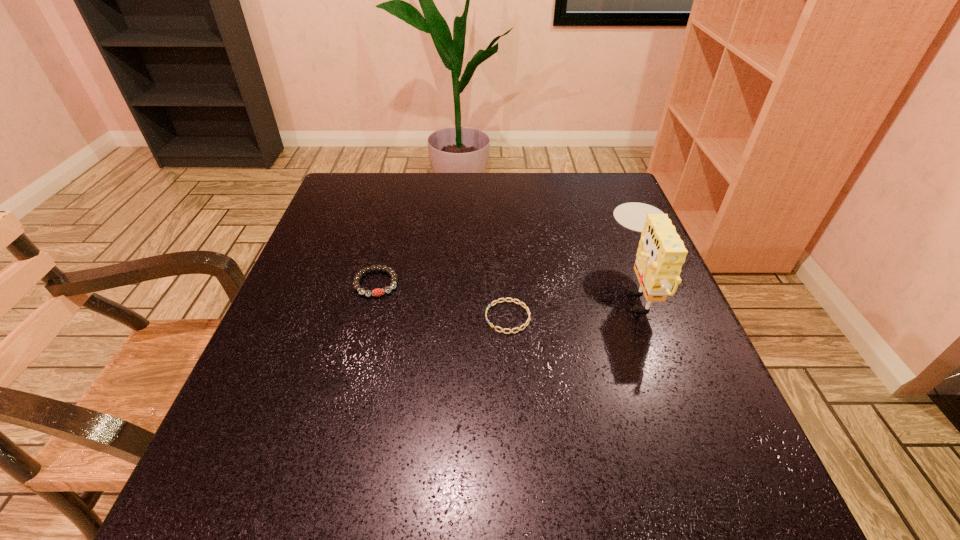
This screenshot has width=960, height=540. I want to click on the tallest object, so click(x=661, y=253).

This screenshot has width=960, height=540. In order to click on sponge in this screenshot , I will do 661,253.

Locate an element on the screen. the farther bracelet is located at coordinates (377, 292).

The width and height of the screenshot is (960, 540). Identify the location of the second tallest object. (377, 292).

Identify the location of the shorter bracelet. (512, 300).

Find the location of `the shortest object`. the shortest object is located at coordinates (512, 300).

Where is `vacant space located 0.280m on the front-facing side of the rightmost object`? vacant space located 0.280m on the front-facing side of the rightmost object is located at coordinates (479, 288).

This screenshot has height=540, width=960. I want to click on vacant area situated on the front-facing side of the rightmost object, so click(421, 288).

What are the coordinates of `vacant space located on the front-facing side of the rightmost object` in the screenshot? It's located at (588, 288).

Image resolution: width=960 pixels, height=540 pixels. Find the location of `free space located 0.330m on the back of the leftmost object`. free space located 0.330m on the back of the leftmost object is located at coordinates (400, 191).